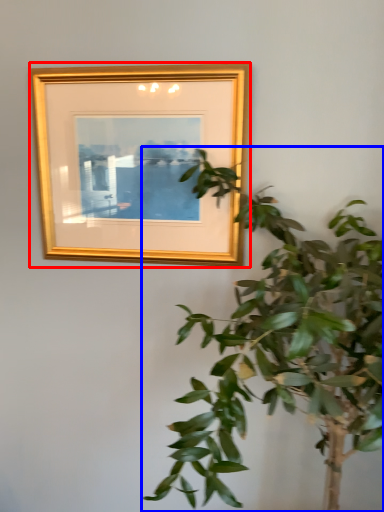
Question: Which object is further to the camera taking this photo, picture frame (highlighted by a red box) or houseplant (highlighted by a blue box)?

Choices:
 (A) picture frame
 (B) houseplant

Answer: (A)